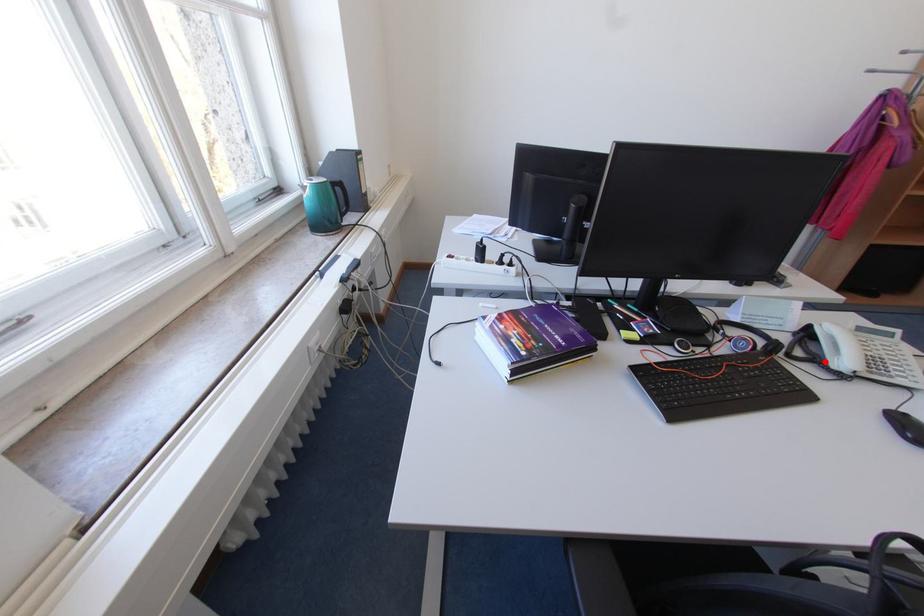
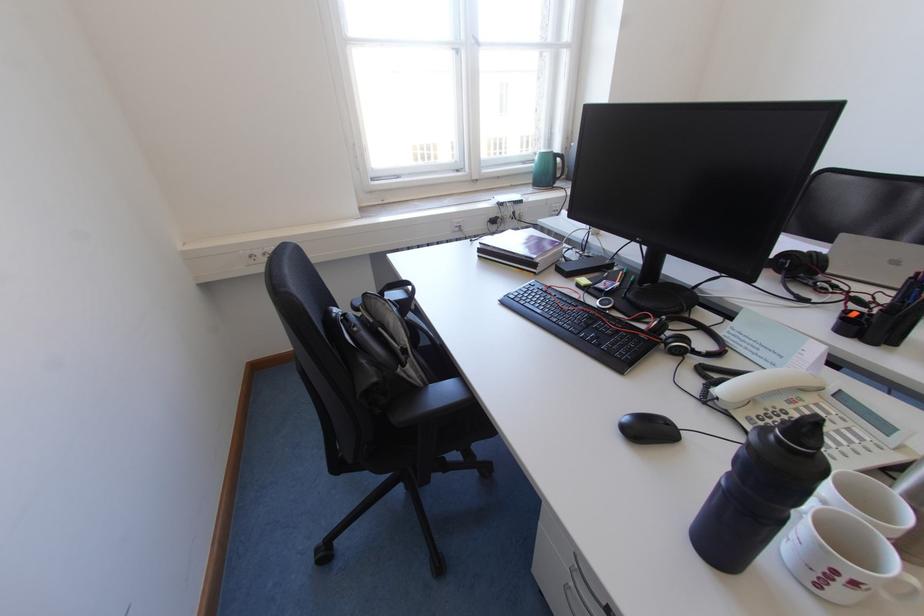
Locate, in the second image, the point that corresponds to the highlighted location in the first image.

(723, 384)